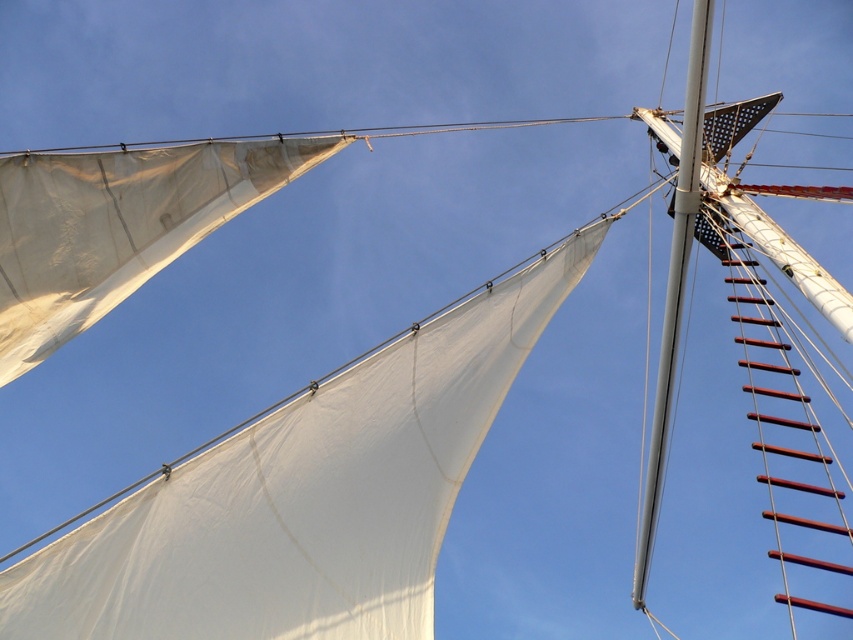
You are a sailor on a sailboat and need to climb from the rustic wood ladder at right to the silver metallic mast at upper right. Given that your safety harness has a 8 meter rope, will you be able to reach the mast without extending the rope?

The rustic wood ladder at right and silver metallic mast at upper right are 8.29 meters apart. Since the safety harness rope is only 8 meters, you will not be able to reach the mast without extending the rope.

You are standing on the deck of the sailboat and want to climb up to the top of the mast. There is a ladder at point (793, 444). Is the ladder on the right side of the mast?

Yes, the ladder at point (793, 444) is on the right side of the mast because the Objects Description states that the point corresponds to a rustic wood ladder at right.